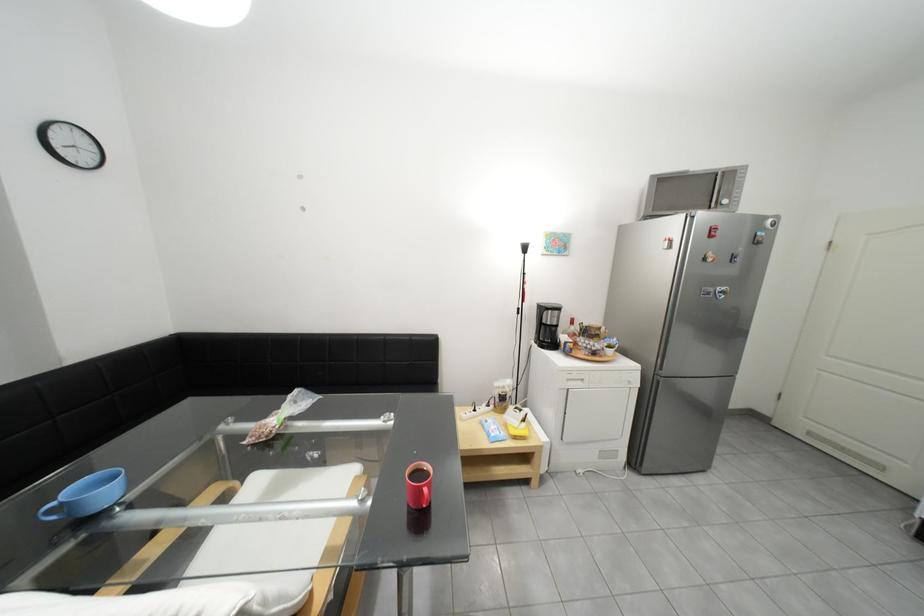
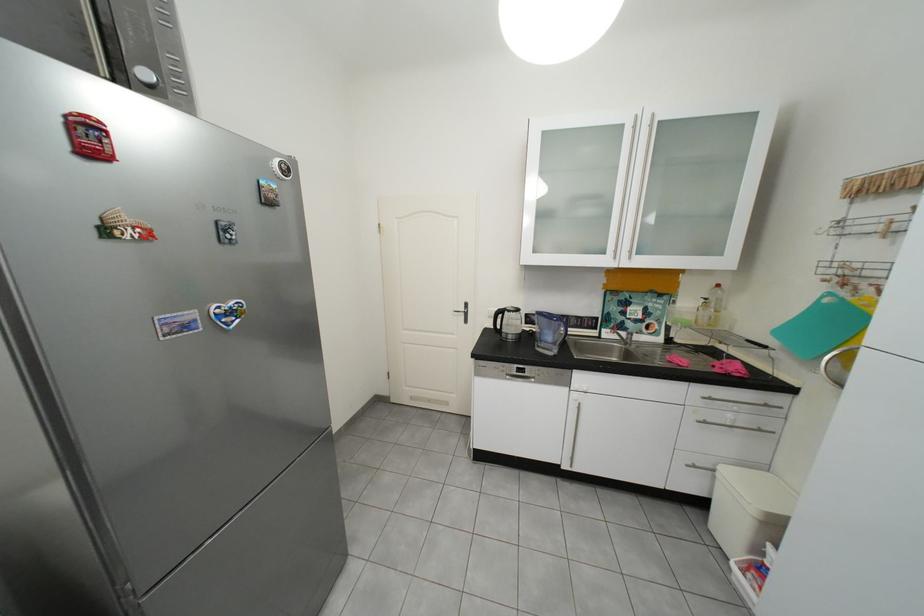
Locate, in the second image, the point that corresponds to (x=736, y=203) in the first image.

(156, 75)